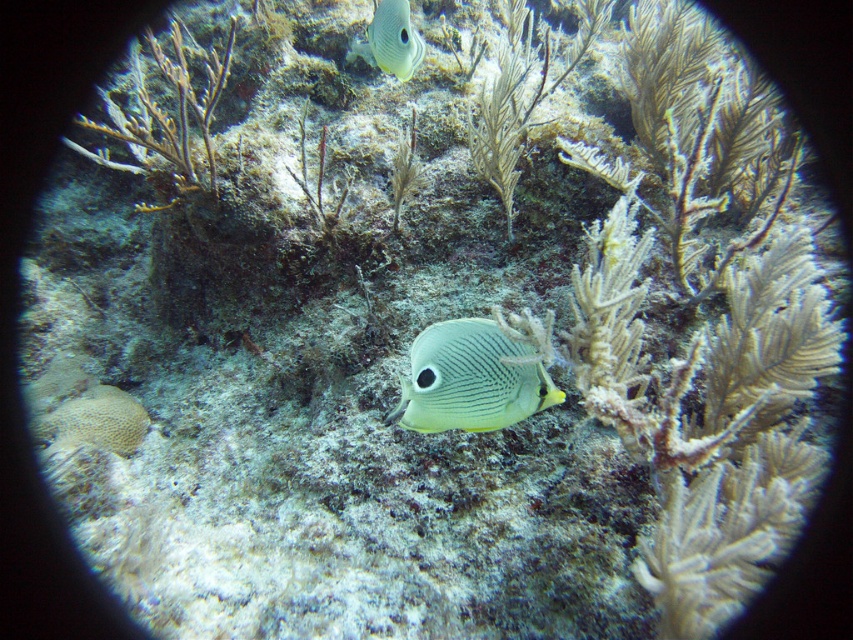
Does point (437, 417) come behind point (398, 52)?

No, (437, 417) is closer to viewer.

Which of these two, translucent yellow fish at center or translucent white fish at center, stands taller?

translucent white fish at center is taller.

Find the location of a particular element. translucent yellow fish at center is located at coordinates (469, 380).

Locate an element on the screen. translucent yellow fish at center is located at coordinates (469, 380).